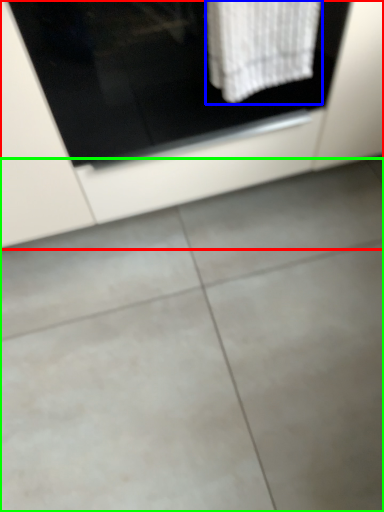
Question: Which object is the farthest from cabinetry (highlighted by a red box)? Choose among these: bath towel (highlighted by a blue box) or concrete (highlighted by a green box).

Choices:
 (A) bath towel
 (B) concrete

Answer: (B)